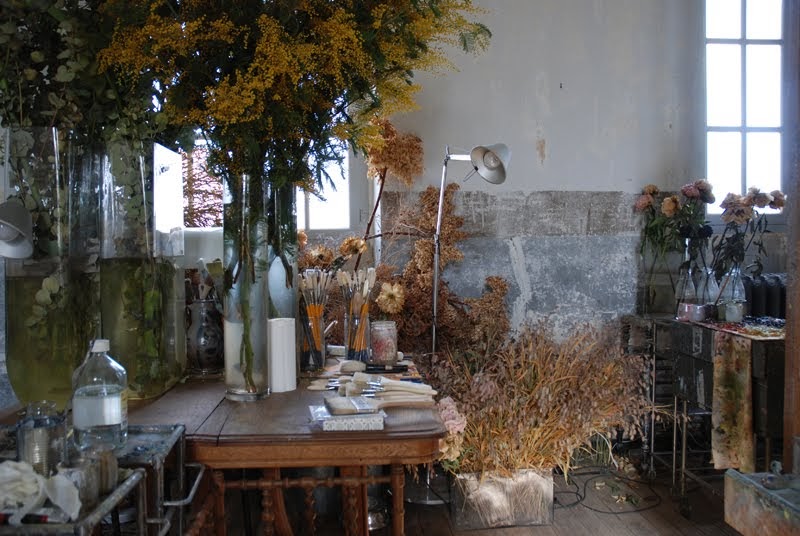
The image size is (800, 536). Find the location of `vase`. vase is located at coordinates (134, 335), (185, 329), (248, 357), (658, 294), (690, 292), (728, 293).